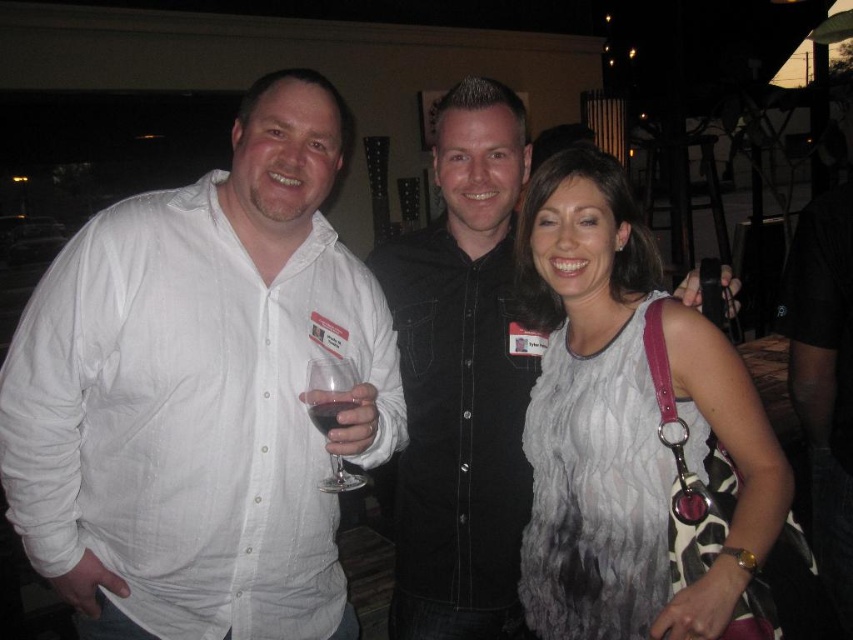
You are standing in front of the three people in the image and want to touch both the point at (724, 378) and the point at (323, 412). Which point should you reach for first?

You should reach for point (724, 378) first because it is closer to you than point (323, 412).

You are a photographer at the event and need to ensure the white textured dress at center and the dark red liquid at center are both visible in the photo. Based on their positions, which object should be placed closer to the light source to avoid shadows?

The dark red liquid at center should be placed closer to the light source because the white textured dress at center is positioned on the right side of it, so moving the dark red liquid at center towards the light will help both objects receive adequate illumination without casting shadows.

You are standing at the origin point in the image and want to locate the white textured dress at center. Which direction should you move to find it?

The white textured dress at center is located at point 0.661 on the x axis and 0.734 on the y axis, so you should move to the right and upwards to reach it.